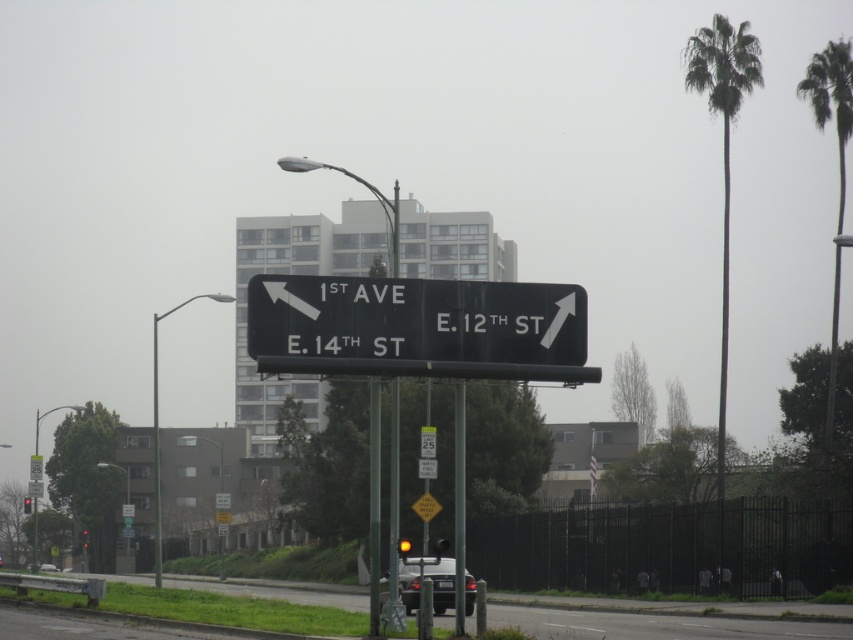
Who is lower down, green leafy palm tree at upper right or yellow glass traffic light at center?

Positioned lower is yellow glass traffic light at center.

Between green leafy palm tree at upper right and yellow glass traffic light at center, which one has less height?

With less height is yellow glass traffic light at center.

Does point (845, 179) lie in front of point (399, 540)?

That is False.

This screenshot has width=853, height=640. What are the coordinates of `green leafy palm tree at upper right` in the screenshot? It's located at (838, 170).

Between black plastic sign at center and metallic pole at left, which one is positioned lower?

metallic pole at left is below.

This screenshot has height=640, width=853. Describe the element at coordinates (418, 326) in the screenshot. I see `black plastic sign at center` at that location.

In order to click on black plastic sign at center in this screenshot , I will do `click(418, 326)`.

Which is more to the left, metallic reflective traffic sign at center or yellow glass traffic light at center?

Positioned to the left is metallic reflective traffic sign at center.

The width and height of the screenshot is (853, 640). Describe the element at coordinates (35, 488) in the screenshot. I see `metallic reflective traffic sign at center` at that location.

You are a GUI agent. You are given a task and a screenshot of the screen. Output one action in this format:
    pyautogui.click(x=<x>, y=<y>)
    Task: Click on the metallic reflective traffic sign at center
    
    Given the screenshot: What is the action you would take?
    pyautogui.click(x=35, y=488)